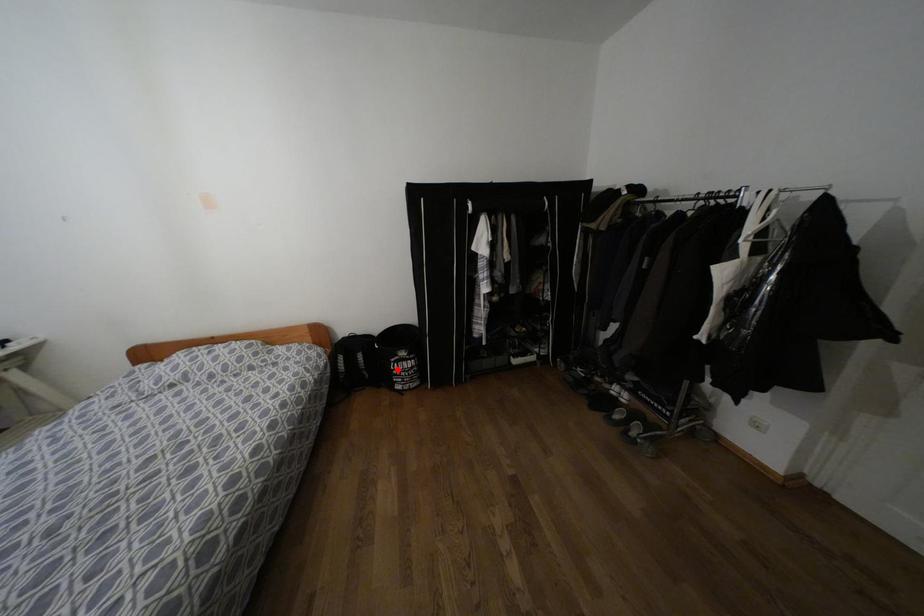
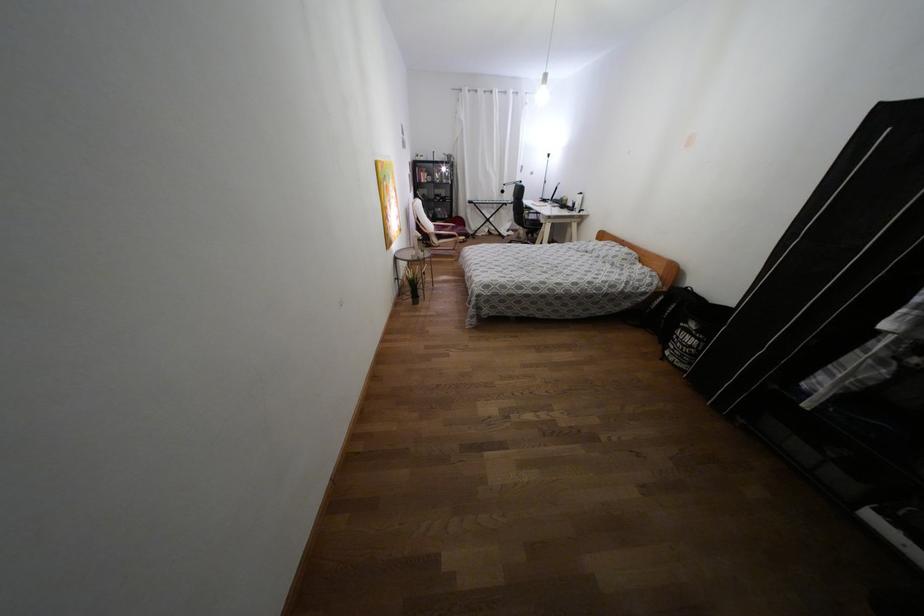
Question: I am providing you with two images of the same scene from different viewpoints. In image1, a red point is highlighted. Considering the same 3D point in image2, which of the following is correct?

Choices:
 (A) It is closer
 (B) It is farther

Answer: (A)